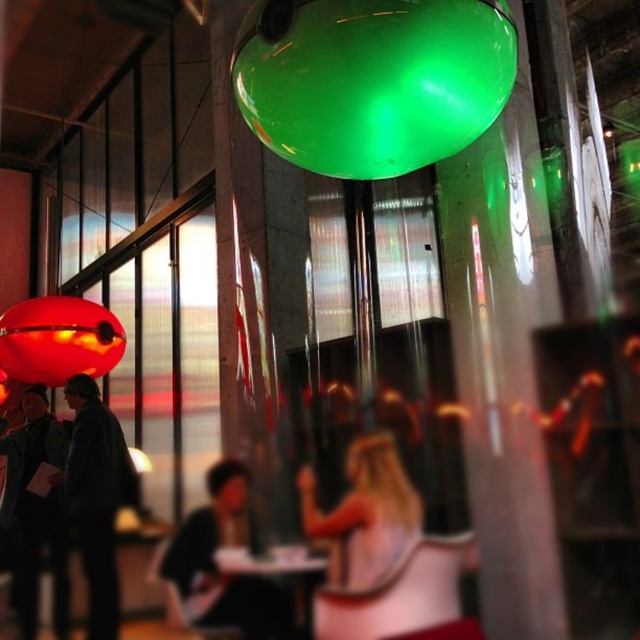
You are an interior designer planning to add a new piece of furniture to the room. The green translucent sphere at upper center and the dark gray jacket at lower left are already present. Which object takes up more space in the room?

The dark gray jacket at lower left occupies more space than the green translucent sphere at upper center.

You are a photographer setting up a shoot in this room. You want to ensure that the blonde hair at center and the matte red balloon at left are both visible in the frame. Given their heights, which object might require you to adjust your camera angle to capture fully?

The blonde hair at center is taller than the matte red balloon at left, so you might need to adjust your camera angle to ensure the taller blonde hair at center is fully captured in the frame.